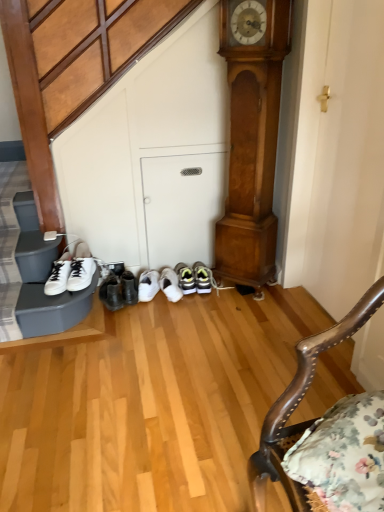
Locate an element on the screen. wooden polished chair at lower right is located at coordinates (297, 406).

What do you see at coordinates (297, 406) in the screenshot? I see `wooden polished chair at lower right` at bounding box center [297, 406].

You are a GUI agent. You are given a task and a screenshot of the screen. Output one action in this format:
    pyautogui.click(x=<x>, y=<y>)
    Task: Click on the white matte sneakers at left
    The image size is (384, 512).
    Given the screenshot: What is the action you would take?
    pyautogui.click(x=71, y=270)

Is polished wood grandfather clock at center aimed at white matte sneakers at left?

No.

Does polished wood grandfather clock at center have a greater width compared to white matte sneakers at left?

In fact, polished wood grandfather clock at center might be narrower than white matte sneakers at left.

How much distance is there between polished wood grandfather clock at center and white matte sneakers at left?

91.36 centimeters.

In terms of height, does white matte sneakers at left look taller or shorter compared to polished wood grandfather clock at center?

Considering their sizes, white matte sneakers at left has less height than polished wood grandfather clock at center.

From the image's perspective, is white matte sneakers at left above polished wood grandfather clock at center?

No, from the image's perspective, white matte sneakers at left is not on top of polished wood grandfather clock at center.

At what (x,y) coordinates should I click in order to perform the action: click on clock that is in front of the white matte sneakers at left. Please return your answer as a coordinate pair (x, y). The height and width of the screenshot is (512, 384). Looking at the image, I should click on (252, 144).

In order to click on chair below the polished wood grandfather clock at center (from the image's perspective) in this screenshot , I will do `click(297, 406)`.

Is polished wood grandfather clock at center bigger or smaller than wooden polished chair at lower right?

In the image, polished wood grandfather clock at center appears to be smaller than wooden polished chair at lower right.

Does polished wood grandfather clock at center turn towards wooden polished chair at lower right?

No, polished wood grandfather clock at center does not turn towards wooden polished chair at lower right.

Does polished wood grandfather clock at center contain wooden polished chair at lower right?

Definitely not — wooden polished chair at lower right is not inside polished wood grandfather clock at center.

Can we say wooden polished chair at lower right lies outside polished wood grandfather clock at center?

Yes, wooden polished chair at lower right is outside of polished wood grandfather clock at center.

From a real-world perspective, is wooden polished chair at lower right above or below polished wood grandfather clock at center?

wooden polished chair at lower right is below polished wood grandfather clock at center.

Is wooden polished chair at lower right at the left side of polished wood grandfather clock at center?

No.

Is wooden polished chair at lower right positioned with its back to polished wood grandfather clock at center?

No.

Identify the location of footwear located above the wooden polished chair at lower right (from the image's perspective). (71, 270).

Is wooden polished chair at lower right facing towards white matte sneakers at left?

No, wooden polished chair at lower right is not facing towards white matte sneakers at left.

From a real-world perspective, is wooden polished chair at lower right below white matte sneakers at left?

Actually, wooden polished chair at lower right is physically above white matte sneakers at left in the real world.

Identify the location of footwear above the wooden polished chair at lower right (from the image's perspective). This screenshot has width=384, height=512. (71, 270).

Is white matte sneakers at left wider or thinner than wooden polished chair at lower right?

Clearly, white matte sneakers at left has less width compared to wooden polished chair at lower right.

Is white matte sneakers at left inside or outside of wooden polished chair at lower right?

white matte sneakers at left exists outside the volume of wooden polished chair at lower right.

Locate an element on the screen. The height and width of the screenshot is (512, 384). clock above the white matte sneakers at left (from the image's perspective) is located at coordinates (252, 144).

What are the coordinates of `footwear below the polished wood grandfather clock at center (from the image's perspective)` in the screenshot? It's located at (71, 270).

Estimate the real-world distances between objects in this image. Which object is closer to white matte sneakers at left, wooden polished chair at lower right or polished wood grandfather clock at center?

polished wood grandfather clock at center lies closer to white matte sneakers at left than the other object.

Estimate the real-world distances between objects in this image. Which object is closer to polished wood grandfather clock at center, white matte sneakers at left or wooden polished chair at lower right?

Based on the image, white matte sneakers at left appears to be nearer to polished wood grandfather clock at center.

Consider the image. Which object lies further to the anchor point polished wood grandfather clock at center, wooden polished chair at lower right or white matte sneakers at left?

wooden polished chair at lower right is further to polished wood grandfather clock at center.

When comparing their distances from white matte sneakers at left, does polished wood grandfather clock at center or wooden polished chair at lower right seem further?

Among the two, wooden polished chair at lower right is located further to white matte sneakers at left.

Which object lies further to the anchor point wooden polished chair at lower right, white matte sneakers at left or polished wood grandfather clock at center?

white matte sneakers at left is positioned further to the anchor wooden polished chair at lower right.

Looking at the image, which one is located further to wooden polished chair at lower right, polished wood grandfather clock at center or white matte sneakers at left?

white matte sneakers at left is positioned further to the anchor wooden polished chair at lower right.

Locate an element on the screen. The height and width of the screenshot is (512, 384). clock between wooden polished chair at lower right and white matte sneakers at left in the front-back direction is located at coordinates (252, 144).